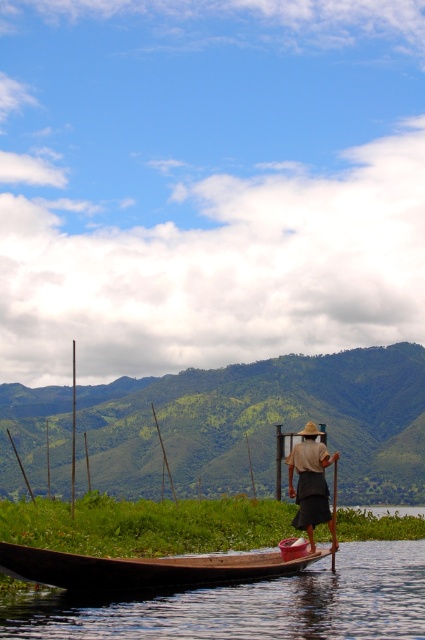
You are standing on a dock and want to board the brown wooden boat at lower left. The dock is 50 feet away from the boat. Can you safely walk from the dock to the boat without needing to swim?

The distance between the brown wooden boat at lower left and the camera is 49.38 feet, which is less than the dock being 50 feet away. Therefore, you can safely walk from the dock to the boat without needing to swim.

You are planning to store the wooden paddle at lower center in the brown wooden boat at lower left. Based on the scene, will the paddle fit inside the boat?

The brown wooden boat at lower left is larger in width than the wooden paddle at lower center, so the paddle should fit inside the boat.

From the picture: You are on a boat and need to retrieve your wooden paddle at lower center. Where should you look relative to the brown wooden canoe at lower center?

The wooden paddle at lower center is located above the brown wooden canoe at lower center, so you should look above the canoe to find it.